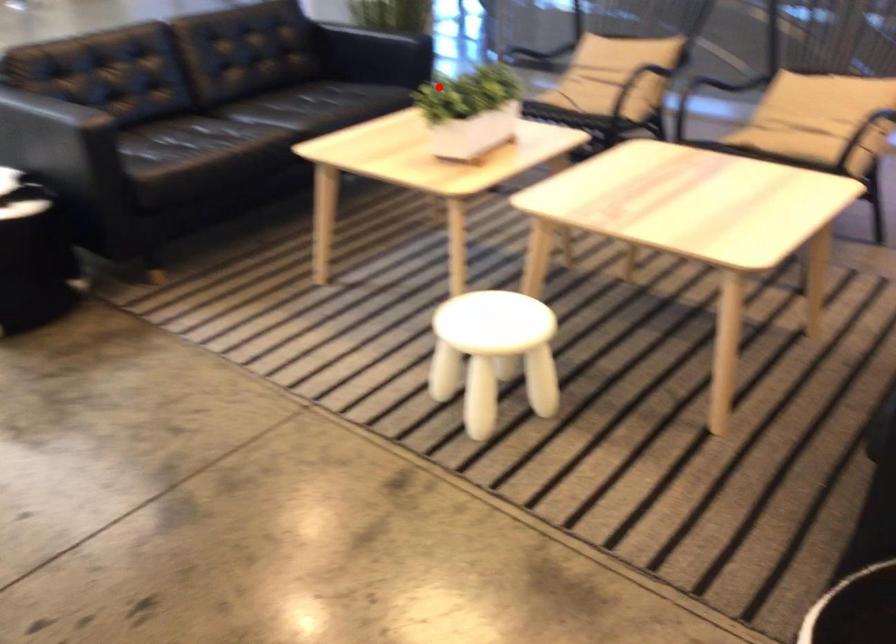
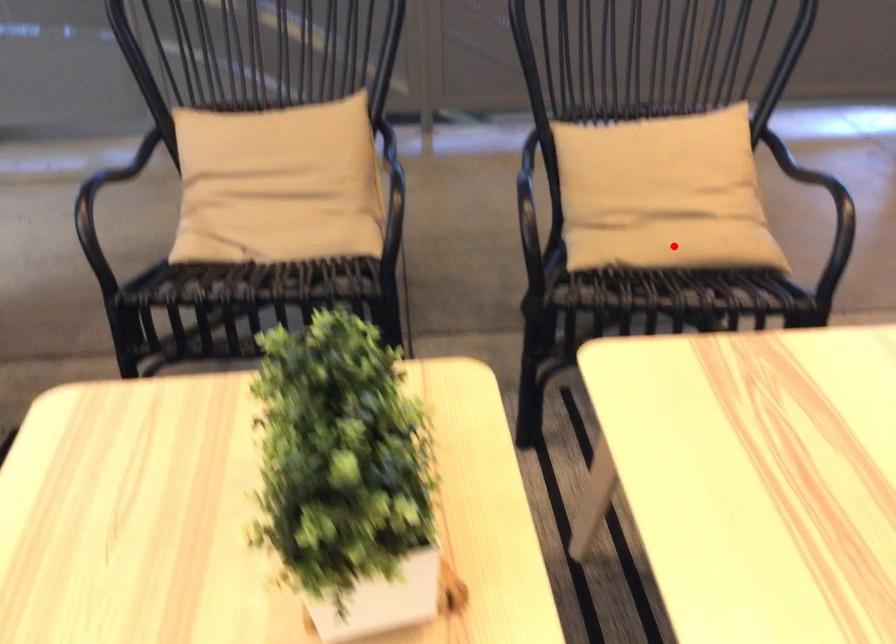
I am providing you with two images of the same scene from different viewpoints. A red point is marked on the first image and another point is marked on the second image. Are the points marked in image1 and image2 representing the same 3D position?

No